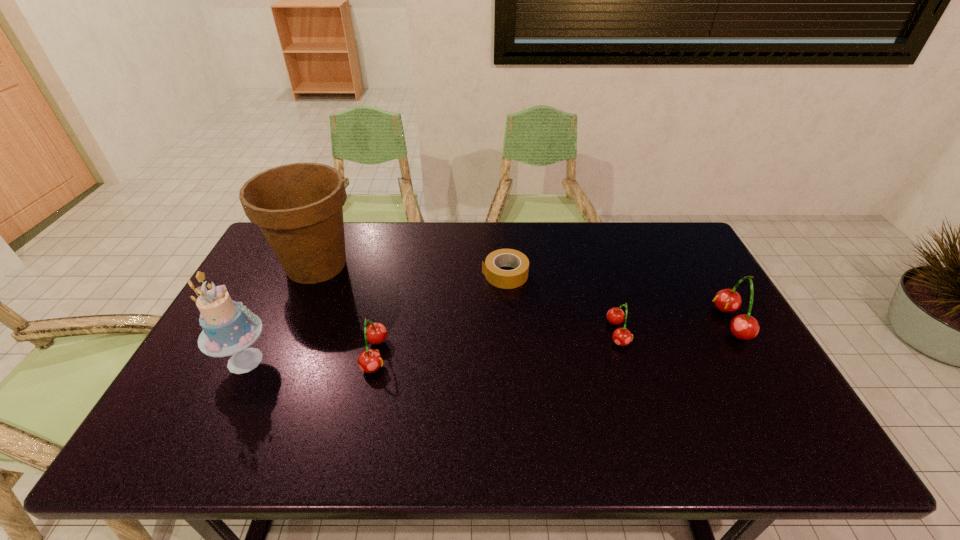
What are the coordinates of `free spot located 0.310m with stems pointing upwards on the second cherry from left to right` in the screenshot? It's located at (738, 333).

You are a GUI agent. You are given a task and a screenshot of the screen. Output one action in this format:
    pyautogui.click(x=<x>, y=<y>)
    Task: Click on the vacant space located 0.050m with stems pointing upwards on the rightmost cherry
    The height and width of the screenshot is (540, 960).
    Given the screenshot: What is the action you would take?
    pyautogui.click(x=700, y=322)

At what (x,y) coordinates should I click in order to perform the action: click on vacant position located 0.250m with stems pointing upwards on the rightmost cherry. Please return your answer as a coordinate pair (x, y). This screenshot has width=960, height=540. Looking at the image, I should click on (630, 322).

This screenshot has width=960, height=540. Find the location of `free space located with stems pointing upwards on the rightmost cherry`. free space located with stems pointing upwards on the rightmost cherry is located at coordinates (643, 322).

The height and width of the screenshot is (540, 960). I want to click on blank space located 0.320m on the front of the flowerpot, so click(x=265, y=381).

Where is `blank space located at the edge of the duct tape`? The width and height of the screenshot is (960, 540). blank space located at the edge of the duct tape is located at coordinates (414, 275).

Where is `vacant region located at the edge of the duct tape`? Image resolution: width=960 pixels, height=540 pixels. vacant region located at the edge of the duct tape is located at coordinates (454, 275).

The height and width of the screenshot is (540, 960). I want to click on vacant space located at the edge of the duct tape, so click(x=361, y=275).

In order to click on free space located with a ladder on the side of the cake in this screenshot , I will do 398,361.

Where is `flowerpot located at the far edge`? Image resolution: width=960 pixels, height=540 pixels. flowerpot located at the far edge is located at coordinates (299, 207).